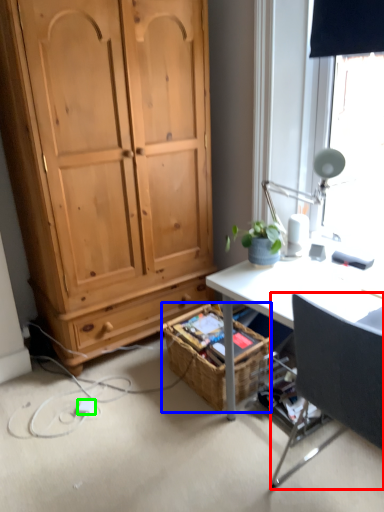
Question: Based on their relative distances, which object is nearer to chair (highlighted by a red box)? Choose from picnic basket (highlighted by a blue box) and power outlet (highlighted by a green box).

Choices:
 (A) picnic basket
 (B) power outlet

Answer: (A)